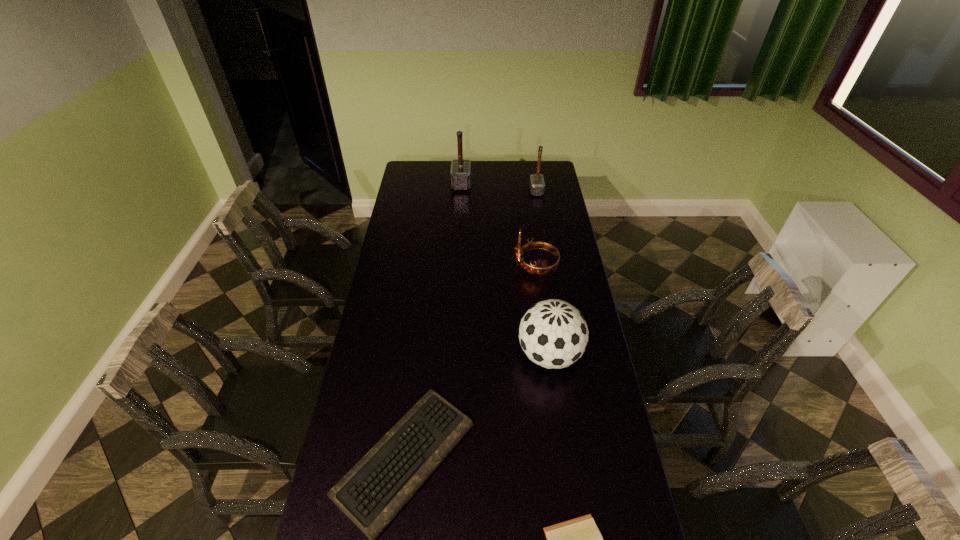
The width and height of the screenshot is (960, 540). I want to click on the tallest object, so (x=460, y=174).

Where is `the taller hammer`? Image resolution: width=960 pixels, height=540 pixels. the taller hammer is located at coordinates (460, 174).

Where is `the right hammer`? This screenshot has height=540, width=960. the right hammer is located at coordinates (537, 185).

The width and height of the screenshot is (960, 540). Find the location of `soccer ball`. soccer ball is located at coordinates (553, 334).

Where is `tiara`? tiara is located at coordinates (532, 269).

Identify the location of free space located 0.320m on the front of the taller hammer. The image size is (960, 540). (459, 228).

This screenshot has height=540, width=960. I want to click on vacant space located on the striking surface of the shorter hammer, so click(x=494, y=191).

Identify the location of vacant space situated on the striking surface of the shorter hammer. 482,191.

What are the coordinates of `vacant space positioned 0.060m on the striking surface of the shorter hammer` in the screenshot? It's located at (519, 191).

Find the location of a particular element. The width and height of the screenshot is (960, 540). free space located on the left of the soccer ball is located at coordinates (414, 355).